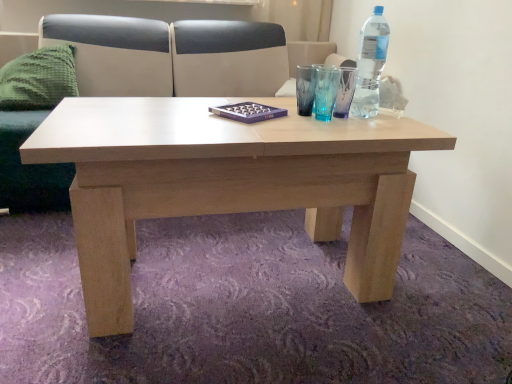
Question: Does green knitted pillow at left lie in front of light beige leather couch at upper center?

Choices:
 (A) no
 (B) yes

Answer: (A)

Question: Considering the relative sizes of green knitted pillow at left and light beige leather couch at upper center in the image provided, is green knitted pillow at left thinner than light beige leather couch at upper center?

Choices:
 (A) no
 (B) yes

Answer: (B)

Question: From a real-world perspective, is green knitted pillow at left physically above light beige leather couch at upper center?

Choices:
 (A) yes
 (B) no

Answer: (A)

Question: Is light beige leather couch at upper center at the back of green knitted pillow at left?

Choices:
 (A) no
 (B) yes

Answer: (B)

Question: Is green knitted pillow at left completely or partially outside of light beige leather couch at upper center?

Choices:
 (A) no
 (B) yes

Answer: (A)

Question: Is green knitted pillow at left positioned behind light beige leather couch at upper center?

Choices:
 (A) no
 (B) yes

Answer: (B)

Question: Considering the relative sizes of green knitted pillow at left and clear plastic bottle at upper right in the image provided, is green knitted pillow at left taller than clear plastic bottle at upper right?

Choices:
 (A) no
 (B) yes

Answer: (A)

Question: Is green knitted pillow at left closer to camera compared to clear plastic bottle at upper right?

Choices:
 (A) no
 (B) yes

Answer: (A)

Question: From a real-world perspective, is green knitted pillow at left on clear plastic bottle at upper right?

Choices:
 (A) no
 (B) yes

Answer: (A)

Question: Would you consider green knitted pillow at left to be distant from clear plastic bottle at upper right?

Choices:
 (A) no
 (B) yes

Answer: (B)

Question: Is green knitted pillow at left facing away from clear plastic bottle at upper right?

Choices:
 (A) yes
 (B) no

Answer: (B)

Question: Is green knitted pillow at left to the left of clear plastic bottle at upper right from the viewer's perspective?

Choices:
 (A) no
 (B) yes

Answer: (B)

Question: Does clear plastic bottle at upper right have a greater height compared to green knitted pillow at left?

Choices:
 (A) yes
 (B) no

Answer: (A)